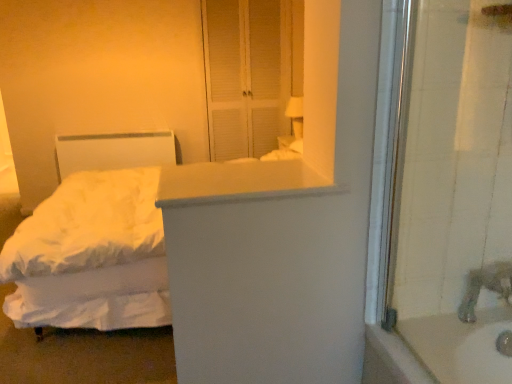
Question: Is white matte counter top at center not near white matte screen door at upper center?

Choices:
 (A) yes
 (B) no

Answer: (A)

Question: From a real-world perspective, is white matte counter top at center located beneath white matte screen door at upper center?

Choices:
 (A) no
 (B) yes

Answer: (B)

Question: Considering the relative sizes of white matte counter top at center and white matte screen door at upper center in the image provided, is white matte counter top at center thinner than white matte screen door at upper center?

Choices:
 (A) yes
 (B) no

Answer: (B)

Question: Does white matte counter top at center appear on the left side of white matte screen door at upper center?

Choices:
 (A) yes
 (B) no

Answer: (B)

Question: From the image's perspective, is white matte counter top at center located beneath white matte screen door at upper center?

Choices:
 (A) no
 (B) yes

Answer: (B)

Question: Is white matte screen door at upper center in front of or behind silver metallic faucet at lower right in the image?

Choices:
 (A) behind
 (B) front

Answer: (A)

Question: Looking at their shapes, would you say white matte screen door at upper center is wider or thinner than silver metallic faucet at lower right?

Choices:
 (A) wide
 (B) thin

Answer: (B)

Question: From the image's perspective, is white matte screen door at upper center above or below silver metallic faucet at lower right?

Choices:
 (A) below
 (B) above

Answer: (B)

Question: Would you say white matte screen door at upper center is to the left or to the right of silver metallic faucet at lower right in the picture?

Choices:
 (A) left
 (B) right

Answer: (A)

Question: Does point (302, 180) appear closer or farther from the camera than point (263, 124)?

Choices:
 (A) farther
 (B) closer

Answer: (B)

Question: In terms of width, does white matte counter top at center look wider or thinner when compared to white matte screen door at upper center?

Choices:
 (A) wide
 (B) thin

Answer: (A)

Question: From a real-world perspective, is white matte counter top at center positioned above or below white matte screen door at upper center?

Choices:
 (A) below
 (B) above

Answer: (A)

Question: Is white matte counter top at center spatially inside white matte screen door at upper center, or outside of it?

Choices:
 (A) outside
 (B) inside

Answer: (A)

Question: Choose the correct answer: Is silver metallic faucet at lower right inside white soft bed at left or outside it?

Choices:
 (A) outside
 (B) inside

Answer: (A)

Question: Based on their positions, is silver metallic faucet at lower right located to the left or right of white soft bed at left?

Choices:
 (A) right
 (B) left

Answer: (A)